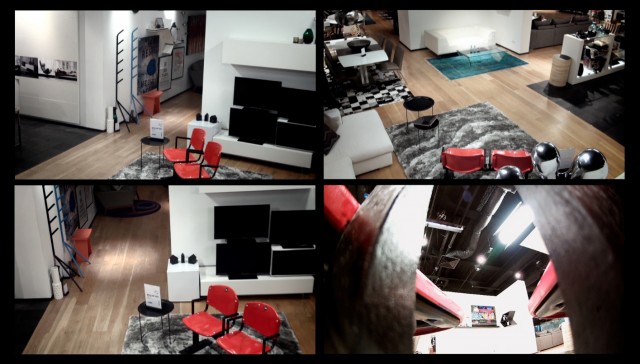
The height and width of the screenshot is (364, 640). Find the location of `seat of red chair`. seat of red chair is located at coordinates (x=241, y=344).